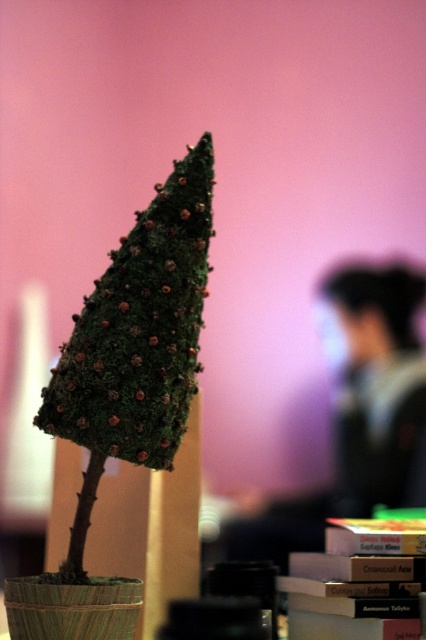
You are an interior designer assessing the space in the image. The green mossy cone at center and the dark hair at upper right are both present. Which object occupies more horizontal space in the image?

The dark hair at upper right occupies more horizontal space because the green mossy cone at center is narrower than it.

You are standing in front of the artificial tree and notice the green mossy cone at center and the dark hair at upper right. Which object is taller when viewed from your perspective?

The dark hair at upper right is taller than the green mossy cone at center.